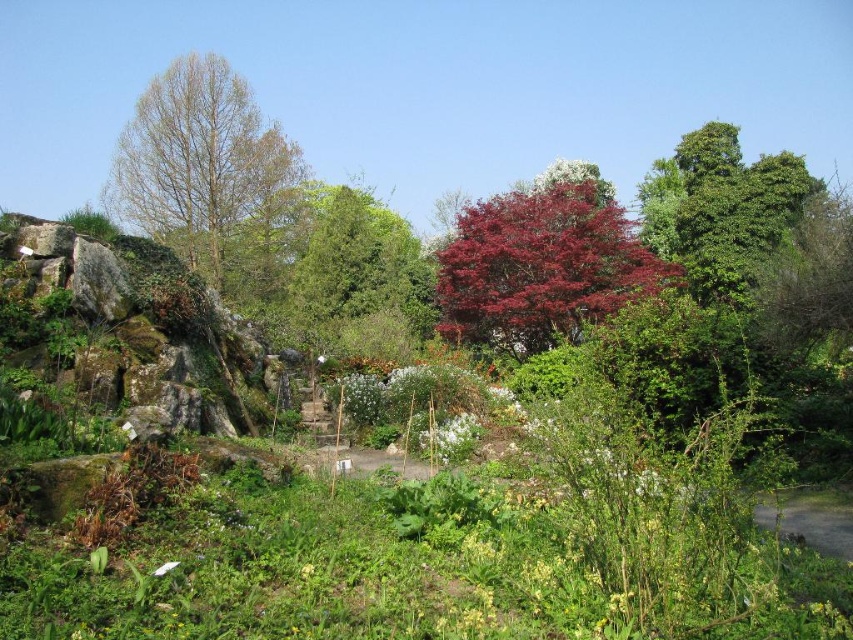
How distant is bare wood tree at left from glossy red tree at center?

37.49 feet

Which is in front, point (157, 184) or point (474, 312)?

Point (474, 312)

Image resolution: width=853 pixels, height=640 pixels. Find the location of `bare wood tree at left`. bare wood tree at left is located at coordinates (212, 177).

Is green mossy rock at left shorter than glossy red tree at center?

Yes.

Between point (91, 337) and point (541, 250), which one is positioned in front?

Point (91, 337)

Where is `green mossy rock at left`? This screenshot has width=853, height=640. green mossy rock at left is located at coordinates (138, 326).

Can you confirm if green mossy rock at left is bigger than bare wood tree at left?

No.

Does green mossy rock at left appear on the left side of bare wood tree at left?

Incorrect, green mossy rock at left is not on the left side of bare wood tree at left.

Is point (183, 380) positioned before point (222, 125)?

Yes.

Where is `green mossy rock at left`? The height and width of the screenshot is (640, 853). green mossy rock at left is located at coordinates (138, 326).